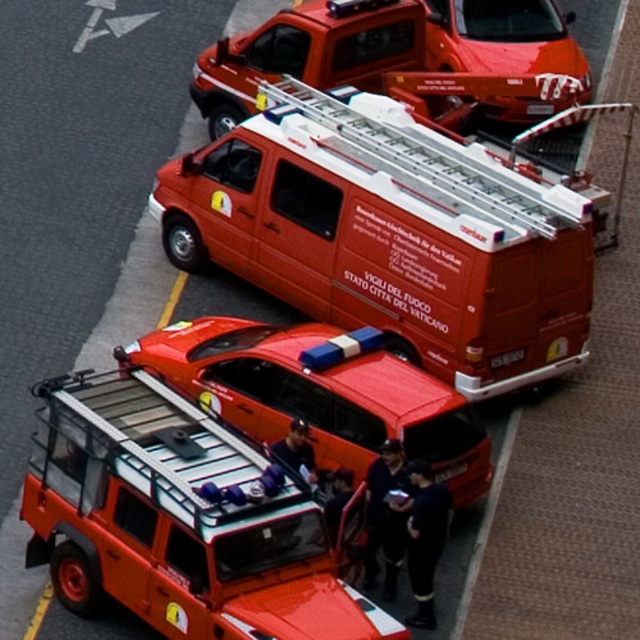
You are a pedestrian on the street where the metallic silver ambulance at center and the metallic red van at upper center are parked. Which vehicle is closer to the left side of the street?

The metallic silver ambulance at center is closer to the left side of the street because it is positioned to the left of the metallic red van at upper center.

Looking at this image, you are standing at the center of the street and see two points marked in the image. Which point, point (467, 371) or point (506, 40), is closer to you?

Point (467, 371) is closer to the viewer than point (506, 40).

You are a firefighter trying to load equipment into the metallic silver ambulance at center and the metallic red car at center. Which vehicle should you choose if you need more vertical space for your equipment?

The metallic silver ambulance at center is taller than the metallic red car at center, so you should choose the metallic silver ambulance at center for more vertical space.